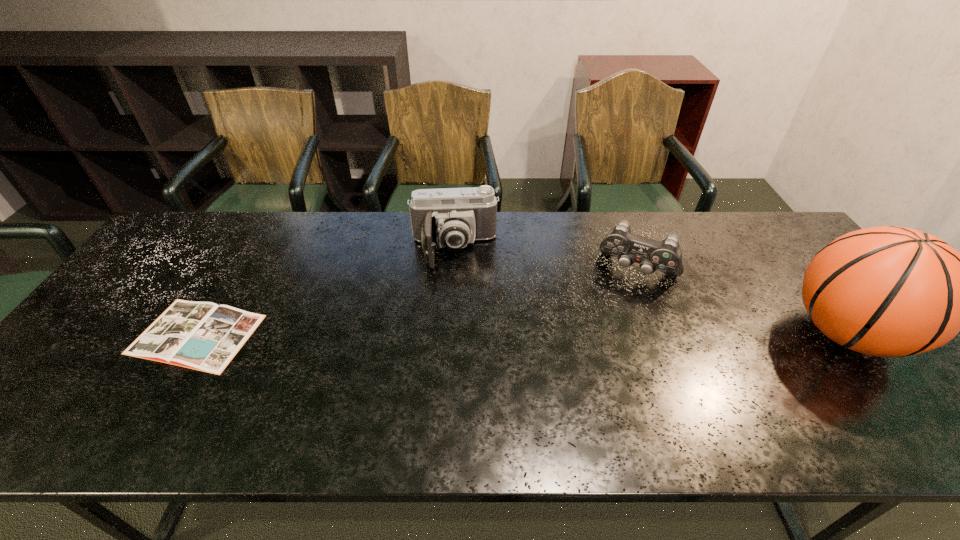
Locate which object is the third closest to the shortest object. Please provide its 2D coordinates. Your answer should be formatted as a tuple, i.e. [(x, y)], where the tuple contains the x and y coordinates of a point satisfying the conditions above.

[(887, 291)]

Identify the location of vacant region that satisfies the following two spatial constraints: 1. on the front side of the control; 2. on the right side of the tallest object. (662, 333).

This screenshot has width=960, height=540. I want to click on free location that satisfies the following two spatial constraints: 1. on the front side of the third object from left to right; 2. on the left side of the rightmost object, so click(x=662, y=333).

Where is `vacant space that satisfies the following two spatial constraints: 1. on the back side of the leftmost object; 2. on the left side of the second object from left to right`? The width and height of the screenshot is (960, 540). vacant space that satisfies the following two spatial constraints: 1. on the back side of the leftmost object; 2. on the left side of the second object from left to right is located at coordinates (248, 250).